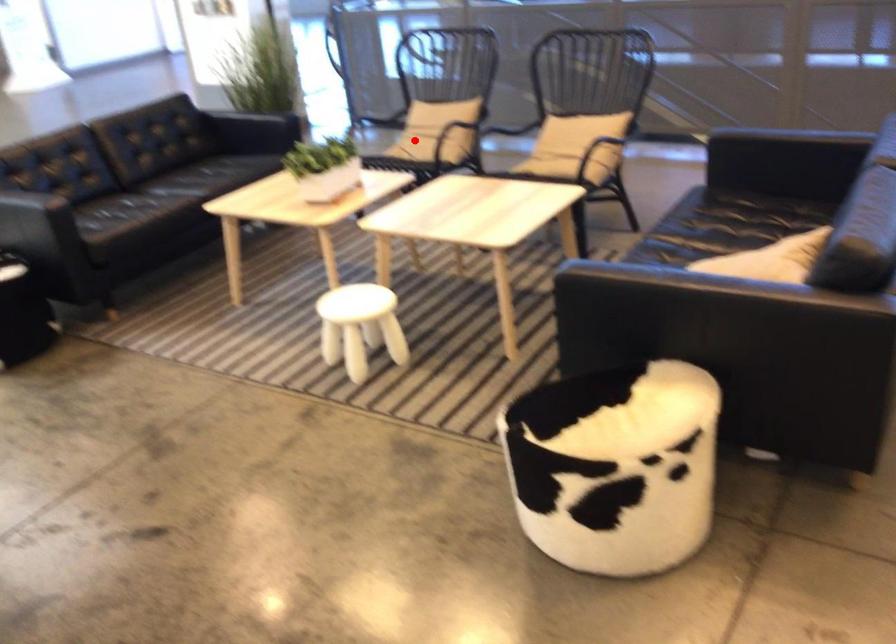
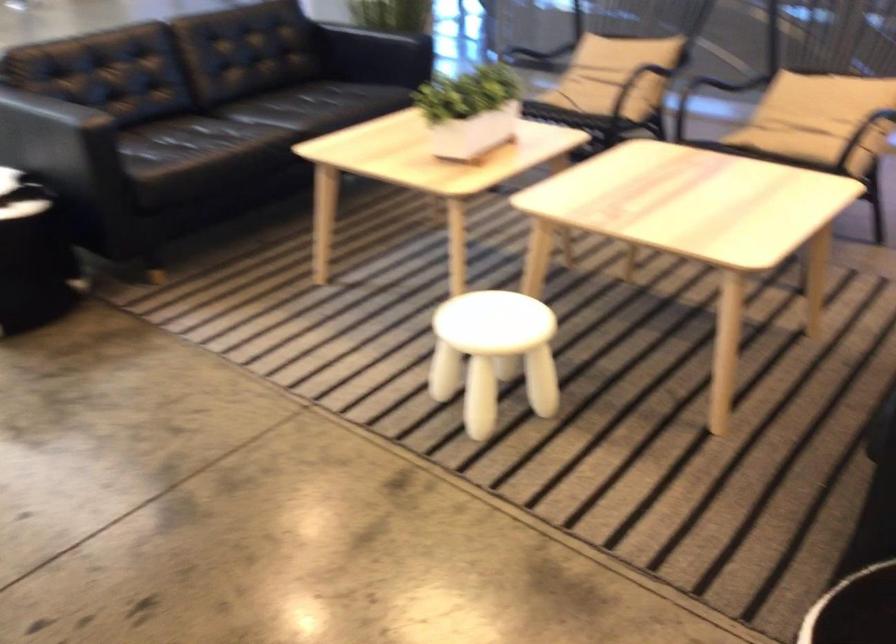
Where in the second image is the point corresponding to the highlighted location from the first image?

(597, 91)